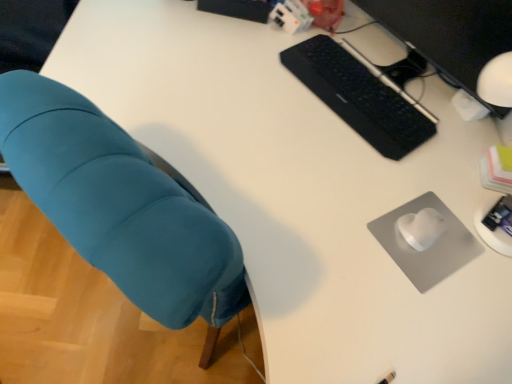
I want to click on vacant area that lies between black matte computer monitor at upper right and black matte keyboard at upper right, so click(400, 99).